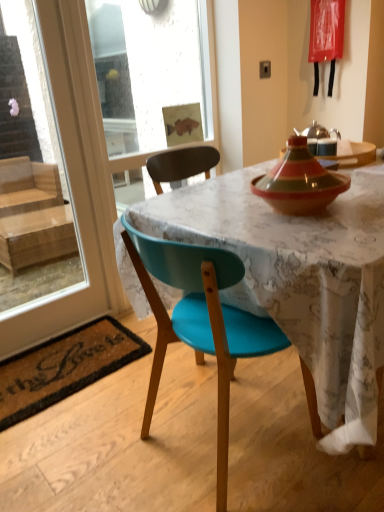
Where is `free space that is in between teal plastic chair at center and coir mat at lower left`? The width and height of the screenshot is (384, 512). free space that is in between teal plastic chair at center and coir mat at lower left is located at coordinates (120, 418).